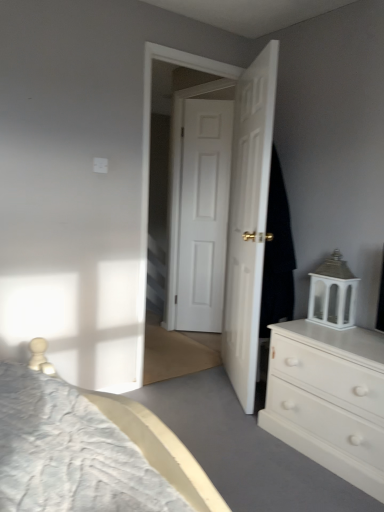
Question: Considering the positions of white matte door at center, placed as the 1th door when sorted from back to front, and black fabric at right in the image, is white matte door at center, placed as the 1th door when sorted from back to front, taller or shorter than black fabric at right?

Choices:
 (A) tall
 (B) short

Answer: (A)

Question: Is white matte door at center, placed as the 1th door when sorted from back to front, to the left or to the right of black fabric at right in the image?

Choices:
 (A) right
 (B) left

Answer: (B)

Question: Estimate the real-world distances between objects in this image. Which object is farther from the white matte chest of drawers at right?

Choices:
 (A) white wooden door at center
 (B) white matte door at center, placed as the 1th door when sorted from back to front
 (C) white glossy door at center, placed as the 2th door when sorted from back to front
 (D) black fabric at right

Answer: (B)

Question: Estimate the real-world distances between objects in this image. Which object is farther from the black fabric at right?

Choices:
 (A) white matte chest of drawers at right
 (B) white matte door at center, marked as the 2th door in a front-to-back arrangement
 (C) white wooden door at center
 (D) white glossy door at center, placed as the 2th door when sorted from back to front

Answer: (B)